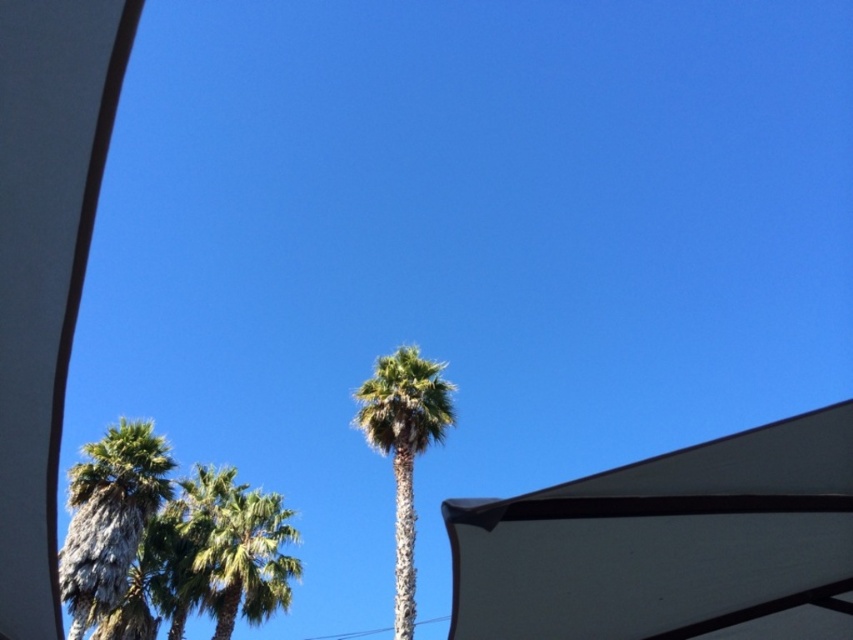
Is point (16, 470) in front of point (244, 508)?

Yes, it is.

Which is below, white matte canopy at left or green leafy palm tree at center?

Answer: green leafy palm tree at center

Does point (120, 52) come behind point (207, 584)?

That is False.

Find the location of a particular element. The image size is (853, 640). white matte canopy at left is located at coordinates (45, 262).

Based on the photo, between white matte umbrella at lower right and green leafy palm tree at center, which one is positioned higher?

white matte umbrella at lower right is higher up.

The height and width of the screenshot is (640, 853). I want to click on white matte umbrella at lower right, so [x=670, y=545].

Where is `white matte umbrella at lower right`? white matte umbrella at lower right is located at coordinates (670, 545).

Does green leafy palm tree at left appear over green leafy palm tree at center?

Yes.

Does green leafy palm tree at left come behind green leafy palm tree at center?

No, green leafy palm tree at left is closer to the viewer.

Between point (134, 497) and point (242, 531), which one is positioned behind?

Positioned behind is point (242, 531).

Where is `green leafy palm tree at left`? Image resolution: width=853 pixels, height=640 pixels. green leafy palm tree at left is located at coordinates (109, 516).